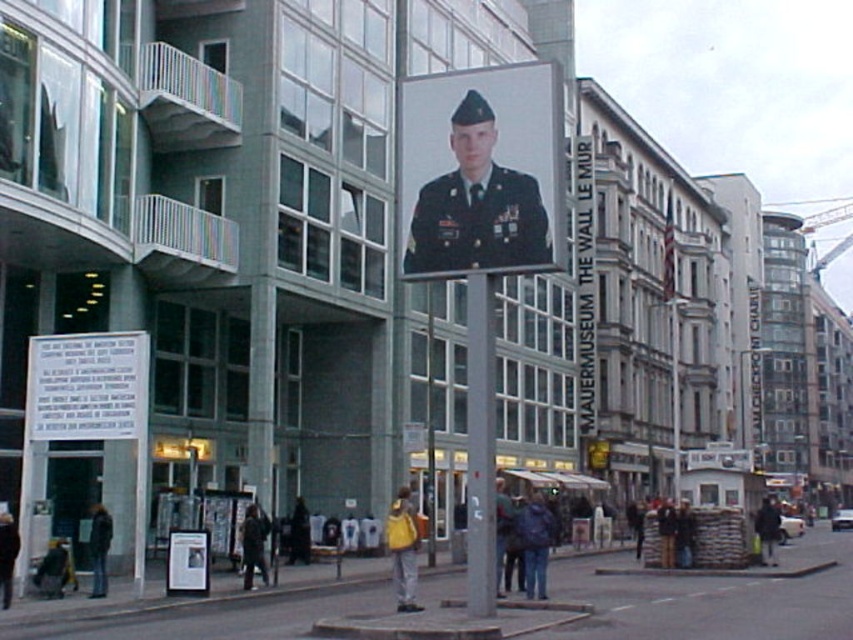
Question: Among these objects, which one is nearest to the camera?

Choices:
 (A) matte black jacket at lower right
 (B) matte black poster at center

Answer: (B)

Question: Estimate the real-world distances between objects in this image. Which object is farther from the dark blue jacket at center?

Choices:
 (A) matte black uniform at center
 (B) dark brown leather jacket at lower center

Answer: (B)

Question: Can you confirm if yellow fabric bag at lower center is smaller than dark blue jacket at center?

Choices:
 (A) no
 (B) yes

Answer: (B)

Question: Which point is farther from the camera taking this photo?

Choices:
 (A) (404, 589)
 (B) (244, 513)
 (C) (202, 531)
 (D) (422, 209)

Answer: (B)

Question: Is yellow fabric bag at lower center smaller than matte black jacket at lower right?

Choices:
 (A) no
 (B) yes

Answer: (A)

Question: Where is matte black poster at center located in relation to dark blue uniform at center in the image?

Choices:
 (A) right
 (B) left

Answer: (A)